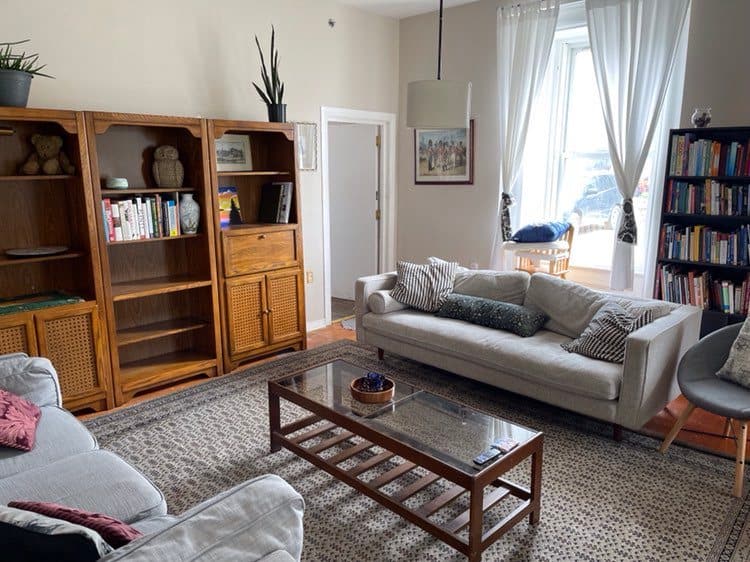
At what (x,y) coordinates should I click in order to perform the action: click on glass and wooden coffee table. Please return your answer as a coordinate pair (x, y). Looking at the image, I should click on (402, 430).